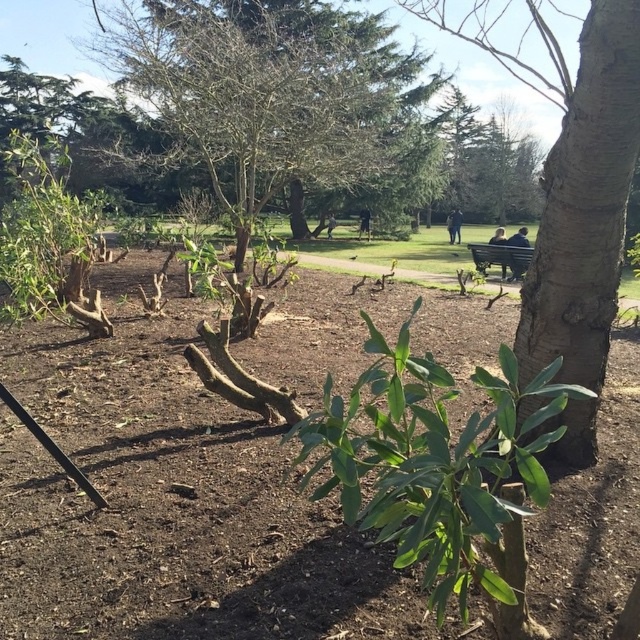
Question: Which object appears farthest from the camera in this image?

Choices:
 (A) bare wood tree at center
 (B) green leafy shrub at center

Answer: (A)

Question: Is green leafy shrub at center below wooden bench at center?

Choices:
 (A) no
 (B) yes

Answer: (A)

Question: Which point is farther to the camera?

Choices:
 (A) green leafy shrub at center
 (B) wooden bench at center

Answer: (B)

Question: Is brown soil at center behind bare wood tree at center?

Choices:
 (A) no
 (B) yes

Answer: (A)

Question: Is green leafy shrub at center bigger than wooden bench at center?

Choices:
 (A) no
 (B) yes

Answer: (B)

Question: Which of these objects is positioned farthest from the green leafy shrub at center?

Choices:
 (A) wooden bench at center
 (B) bare wood tree at center

Answer: (A)